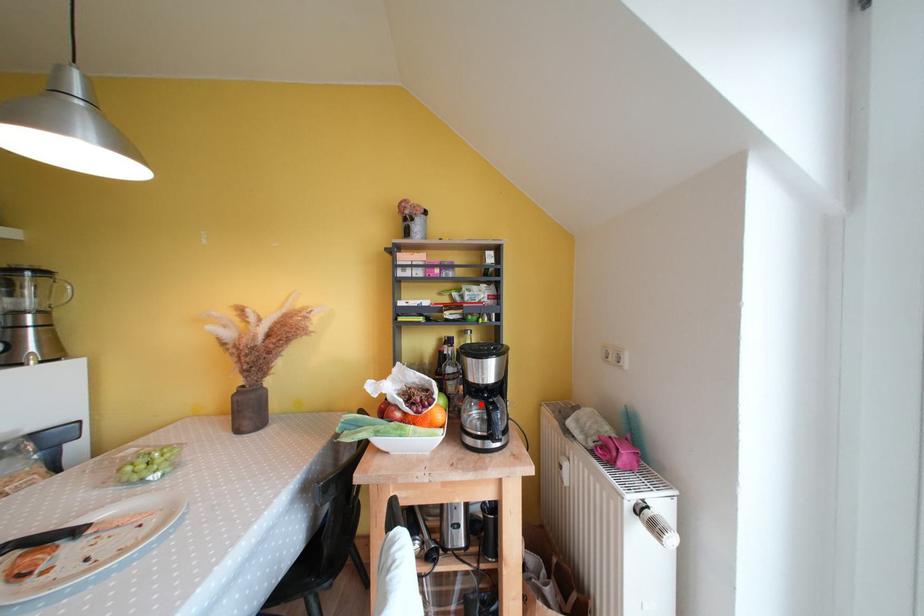
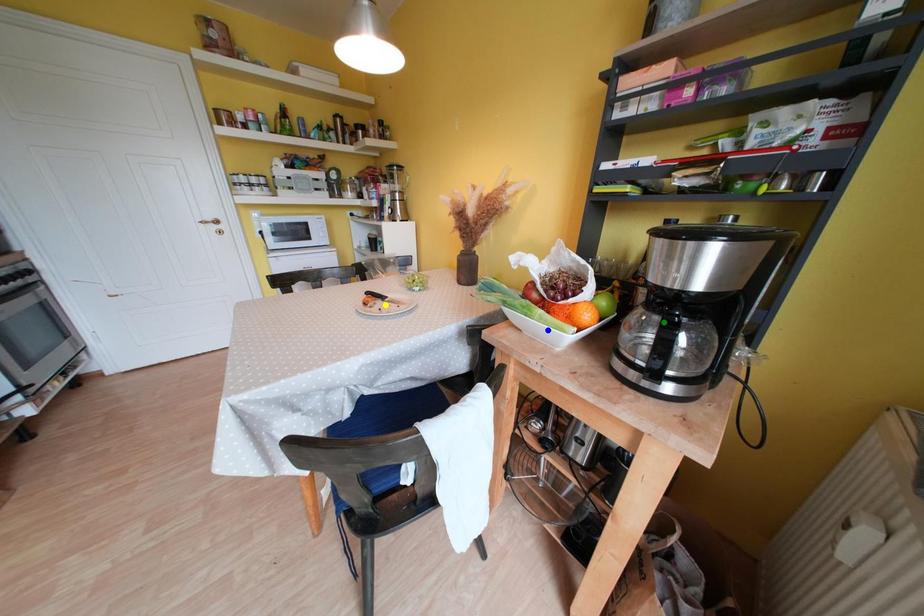
Question: I am providing you with two images of the same scene from different viewpoints. A red point is marked on the first image. You are given multiple points on the second image. Which spot in image 2 lines up with the point in image 1?

Choices:
 (A) blue point
 (B) yellow point
 (C) green point

Answer: (C)